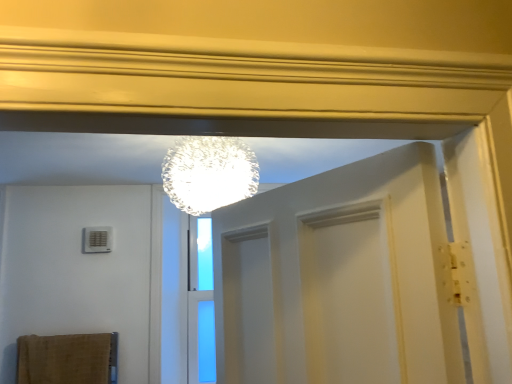
Question: From the image's perspective, would you say transparent glass sphere at upper center is positioned over burlap bath towel at lower left?

Choices:
 (A) yes
 (B) no

Answer: (A)

Question: Would you consider transparent glass sphere at upper center to be distant from burlap bath towel at lower left?

Choices:
 (A) yes
 (B) no

Answer: (A)

Question: Is burlap bath towel at lower left surrounded by transparent glass sphere at upper center?

Choices:
 (A) no
 (B) yes

Answer: (A)

Question: Is transparent glass sphere at upper center to the right of burlap bath towel at lower left from the viewer's perspective?

Choices:
 (A) no
 (B) yes

Answer: (B)

Question: Is transparent glass sphere at upper center at the left side of burlap bath towel at lower left?

Choices:
 (A) no
 (B) yes

Answer: (A)

Question: From a real-world perspective, does transparent glass sphere at upper center stand above burlap bath towel at lower left?

Choices:
 (A) yes
 (B) no

Answer: (A)

Question: Can you confirm if burlap bath towel at lower left is smaller than transparent glass sphere at upper center?

Choices:
 (A) yes
 (B) no

Answer: (A)

Question: Is burlap bath towel at lower left further to camera compared to transparent glass sphere at upper center?

Choices:
 (A) no
 (B) yes

Answer: (B)

Question: Is the depth of burlap bath towel at lower left less than that of transparent glass sphere at upper center?

Choices:
 (A) no
 (B) yes

Answer: (A)

Question: Does burlap bath towel at lower left contain transparent glass sphere at upper center?

Choices:
 (A) yes
 (B) no

Answer: (B)

Question: Is burlap bath towel at lower left taller than transparent glass sphere at upper center?

Choices:
 (A) yes
 (B) no

Answer: (B)

Question: From the image's perspective, is burlap bath towel at lower left above transparent glass sphere at upper center?

Choices:
 (A) no
 (B) yes

Answer: (A)

Question: Looking at the image, does transparent glass sphere at upper center seem bigger or smaller compared to burlap bath towel at lower left?

Choices:
 (A) small
 (B) big

Answer: (B)